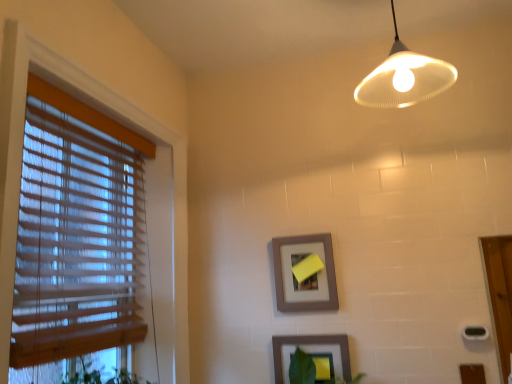
Measure the distance between point (385, 64) and camera.

The distance of point (385, 64) from camera is 1.35 meters.

Identify the location of matte gray picture frame at lower center, the 1th picture frame from the bottom. (310, 351).

Considering the sizes of objects matte gray picture frame at center, the second picture frame from the bottom, and matte white lampshade at upper center in the image provided, who is smaller, matte gray picture frame at center, the second picture frame from the bottom, or matte white lampshade at upper center?

Smaller between the two is matte gray picture frame at center, the second picture frame from the bottom.

From the picture: Does matte gray picture frame at center, the 1th picture frame from the top, turn towards matte white lampshade at upper center?

No, matte gray picture frame at center, the 1th picture frame from the top, does not turn towards matte white lampshade at upper center.

In the scene shown: How many degrees apart are the facing directions of matte gray picture frame at center, the second picture frame from the bottom, and matte white lampshade at upper center?

There is a 0.194-degree angle between the facing directions of matte gray picture frame at center, the second picture frame from the bottom, and matte white lampshade at upper center.

Who is taller, wooden blinds at left or matte gray picture frame at center, the 1th picture frame from the top?

wooden blinds at left.

Between wooden blinds at left and matte gray picture frame at center, the 1th picture frame from the top, which one is positioned behind?

matte gray picture frame at center, the 1th picture frame from the top, is more distant.

From a real-world perspective, is wooden blinds at left positioned over matte gray picture frame at center, the second picture frame from the bottom, based on gravity?

Yes, from a real-world perspective, wooden blinds at left is above matte gray picture frame at center, the second picture frame from the bottom.

Is wooden blinds at left completely or partially outside of matte gray picture frame at center, the 1th picture frame from the top?

Absolutely, wooden blinds at left is external to matte gray picture frame at center, the 1th picture frame from the top.

Based on the photo, who is smaller, matte gray picture frame at center, the second picture frame from the bottom, or matte gray picture frame at lower center, the 1th picture frame from the bottom?

With smaller size is matte gray picture frame at lower center, the 1th picture frame from the bottom.

Which object is further away from the camera taking this photo, matte gray picture frame at center, the 1th picture frame from the top, or matte gray picture frame at lower center, the second picture frame from the top?

matte gray picture frame at center, the 1th picture frame from the top.

From the picture: From a real-world perspective, which object stands above the other?

matte gray picture frame at center, the second picture frame from the bottom.

From the image's perspective, does matte gray picture frame at center, the second picture frame from the bottom, appear lower than matte gray picture frame at lower center, the second picture frame from the top?

No, from the image's perspective, matte gray picture frame at center, the second picture frame from the bottom, is not below matte gray picture frame at lower center, the second picture frame from the top.

Does wooden blinds at left have a lesser height compared to matte white lampshade at upper center?

No.

From the image's perspective, does wooden blinds at left appear lower than matte white lampshade at upper center?

Indeed, from the image's perspective, wooden blinds at left is shown beneath matte white lampshade at upper center.

Image resolution: width=512 pixels, height=384 pixels. What are the coordinates of `window blind below the matte white lampshade at upper center (from the image's perspective)` in the screenshot? It's located at (78, 232).

From the image's perspective, count 2nd picture frames downward from the matte white lampshade at upper center and point to it. Please provide its 2D coordinates.

[(310, 351)]

Considering the relative positions of matte white lampshade at upper center and matte gray picture frame at lower center, the 1th picture frame from the bottom, in the image provided, is matte white lampshade at upper center to the left of matte gray picture frame at lower center, the 1th picture frame from the bottom, from the viewer's perspective?

Incorrect, matte white lampshade at upper center is not on the left side of matte gray picture frame at lower center, the 1th picture frame from the bottom.

From the image's perspective, is matte white lampshade at upper center located above or below matte gray picture frame at lower center, the 1th picture frame from the bottom?

Clearly, from the image's perspective, matte white lampshade at upper center is above matte gray picture frame at lower center, the 1th picture frame from the bottom.

Does point (73, 271) appear closer or farther from the camera than point (335, 349)?

Clearly, point (73, 271) is closer to the camera than point (335, 349).

Could you measure the distance between wooden blinds at left and matte gray picture frame at lower center, the second picture frame from the top?

wooden blinds at left and matte gray picture frame at lower center, the second picture frame from the top, are 33.17 inches apart from each other.

In the image, there is a matte gray picture frame at lower center, the 1th picture frame from the bottom. At what (x,y) coordinates should I click in order to perform the action: click on window blind above it (from the image's perspective). Please return your answer as a coordinate pair (x, y). Looking at the image, I should click on (78, 232).

From a real-world perspective, is wooden blinds at left over matte gray picture frame at lower center, the second picture frame from the top?

Yes.

Considering the points (300, 341) and (58, 142), which point is in front, point (300, 341) or point (58, 142)?

The point (58, 142) is closer to the camera.

Is matte gray picture frame at lower center, the 1th picture frame from the bottom, not within wooden blinds at left?

That's correct, matte gray picture frame at lower center, the 1th picture frame from the bottom, is outside of wooden blinds at left.

Based on the photo, from a real-world perspective, between matte gray picture frame at lower center, the 1th picture frame from the bottom, and wooden blinds at left, who is vertically lower?

From a 3D spatial view, matte gray picture frame at lower center, the 1th picture frame from the bottom, is below.

Would you consider matte gray picture frame at lower center, the second picture frame from the top, to be distant from wooden blinds at left?

No, matte gray picture frame at lower center, the second picture frame from the top, is not far away from wooden blinds at left.

The height and width of the screenshot is (384, 512). In order to click on lamp positioned vertically above the matte gray picture frame at center, the second picture frame from the bottom (from a real-world perspective) in this screenshot , I will do `click(404, 78)`.

Image resolution: width=512 pixels, height=384 pixels. I want to click on the 2nd picture frame behind the wooden blinds at left, so click(313, 275).

Which object lies further to the anchor point matte white lampshade at upper center, matte gray picture frame at center, the second picture frame from the bottom, or wooden blinds at left?

wooden blinds at left is further to matte white lampshade at upper center.

Looking at the image, which one is located further to matte white lampshade at upper center, matte gray picture frame at center, the 1th picture frame from the top, or matte gray picture frame at lower center, the second picture frame from the top?

Among the two, matte gray picture frame at lower center, the second picture frame from the top, is located further to matte white lampshade at upper center.

Estimate the real-world distances between objects in this image. Which object is closer to matte gray picture frame at center, the second picture frame from the bottom, matte white lampshade at upper center or matte gray picture frame at lower center, the second picture frame from the top?

matte gray picture frame at lower center, the second picture frame from the top, lies closer to matte gray picture frame at center, the second picture frame from the bottom, than the other object.

Based on their spatial positions, is matte white lampshade at upper center or wooden blinds at left closer to matte gray picture frame at lower center, the 1th picture frame from the bottom?

wooden blinds at left is positioned closer to the anchor matte gray picture frame at lower center, the 1th picture frame from the bottom.

Which object lies further to the anchor point wooden blinds at left, matte gray picture frame at lower center, the second picture frame from the top, or matte gray picture frame at center, the second picture frame from the bottom?

The object further to wooden blinds at left is matte gray picture frame at lower center, the second picture frame from the top.

When comparing their distances from wooden blinds at left, does matte gray picture frame at center, the second picture frame from the bottom, or matte white lampshade at upper center seem closer?

matte gray picture frame at center, the second picture frame from the bottom, is positioned closer to the anchor wooden blinds at left.

Looking at the image, which one is located closer to wooden blinds at left, matte gray picture frame at center, the second picture frame from the bottom, or matte gray picture frame at lower center, the second picture frame from the top?

matte gray picture frame at center, the second picture frame from the bottom, is positioned closer to the anchor wooden blinds at left.

Looking at the image, which one is located closer to matte gray picture frame at center, the second picture frame from the bottom, matte white lampshade at upper center or wooden blinds at left?

Based on the image, matte white lampshade at upper center appears to be nearer to matte gray picture frame at center, the second picture frame from the bottom.

You are a GUI agent. You are given a task and a screenshot of the screen. Output one action in this format:
    pyautogui.click(x=<x>, y=<y>)
    Task: Click on the window blind between matte white lampshade at upper center and matte gray picture frame at lower center, the 1th picture frame from the bottom, from top to bottom
    This screenshot has width=512, height=384.
    Given the screenshot: What is the action you would take?
    pyautogui.click(x=78, y=232)

Locate an element on the screen. The width and height of the screenshot is (512, 384). picture frame between wooden blinds at left and matte gray picture frame at lower center, the 1th picture frame from the bottom is located at coordinates (313, 275).

Identify the location of picture frame that lies between matte white lampshade at upper center and matte gray picture frame at lower center, the 1th picture frame from the bottom, from top to bottom. The height and width of the screenshot is (384, 512). (313, 275).